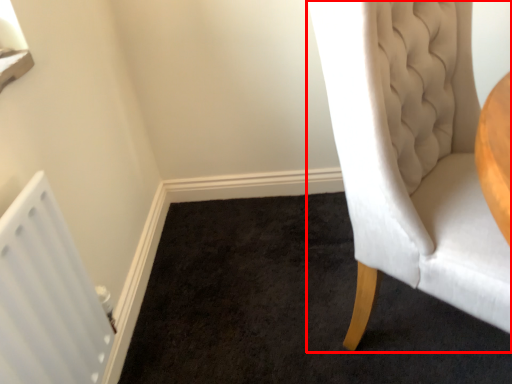
Question: Observing the image, what is the correct spatial positioning of chair (annotated by the red box) in reference to radiator?

Choices:
 (A) left
 (B) right

Answer: (B)